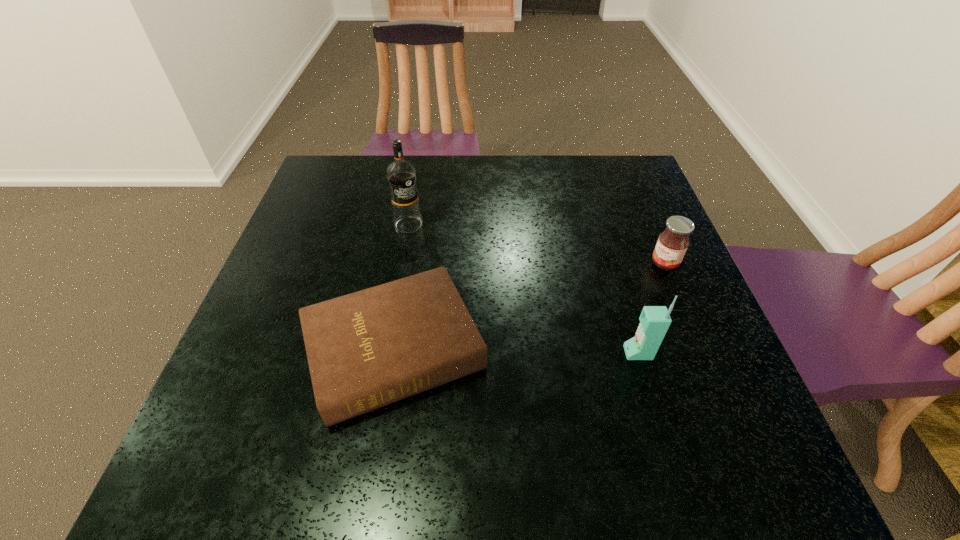
Find the location of a particular element. This screenshot has width=960, height=540. Bible is located at coordinates (365, 350).

I want to click on the second tallest object, so click(654, 320).

Where is `the second object from right to left`? The image size is (960, 540). the second object from right to left is located at coordinates (654, 320).

Where is `the second farthest object`? The width and height of the screenshot is (960, 540). the second farthest object is located at coordinates (672, 244).

This screenshot has width=960, height=540. Identify the location of jam. coord(672,244).

Where is `the tallest object`? This screenshot has width=960, height=540. the tallest object is located at coordinates (401, 175).

The image size is (960, 540). In order to click on vodka in this screenshot , I will do `click(401, 175)`.

In order to click on vacant space situated on the right of the Bible in this screenshot , I will do (x=517, y=350).

You are a GUI agent. You are given a task and a screenshot of the screen. Output one action in this format:
    pyautogui.click(x=<x>, y=<y>)
    Task: Click on the free spot located 0.060m on the keypad of the second tallest object
    
    Given the screenshot: What is the action you would take?
    pyautogui.click(x=594, y=353)

The width and height of the screenshot is (960, 540). I want to click on vacant region located on the keypad of the second tallest object, so click(447, 353).